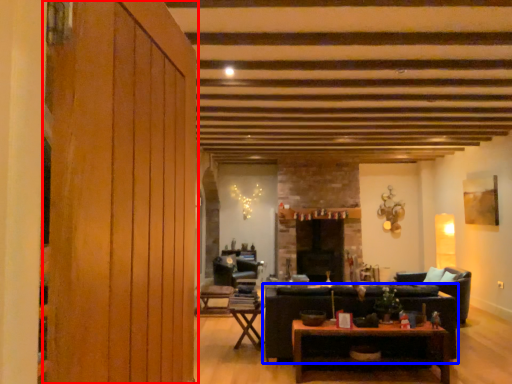
Question: Which point is closer to the camera, barn door (highlighted by a red box) or studio couch (highlighted by a blue box)?

Choices:
 (A) barn door
 (B) studio couch

Answer: (A)